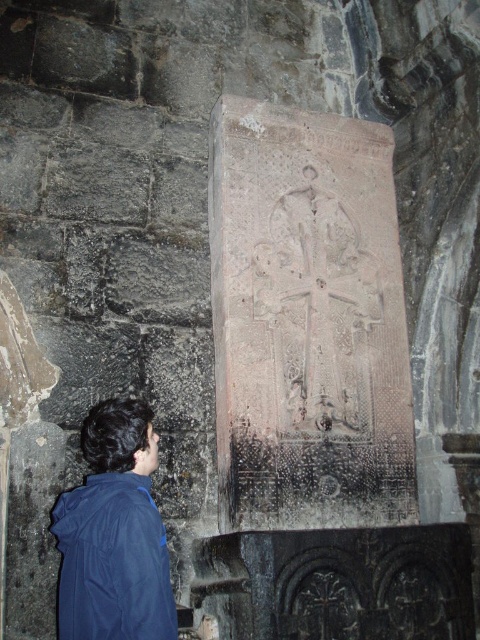
Is gray stone carving at center bigger than blue matte jacket at lower left?

No, gray stone carving at center is not bigger than blue matte jacket at lower left.

Does point (268, 358) lie in front of point (144, 582)?

No, (268, 358) is behind (144, 582).

Which is in front, point (389, 323) or point (153, 531)?

Point (153, 531) is more forward.

Locate an element on the screen. This screenshot has width=480, height=640. gray stone carving at center is located at coordinates (308, 321).